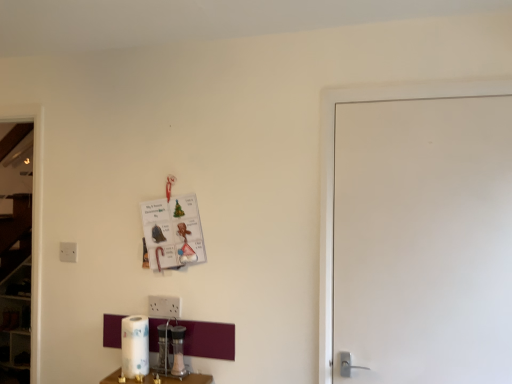
Find the location of `empty space that is ontop of metallic silver salt shaker at lower center`. empty space that is ontop of metallic silver salt shaker at lower center is located at coordinates (161, 375).